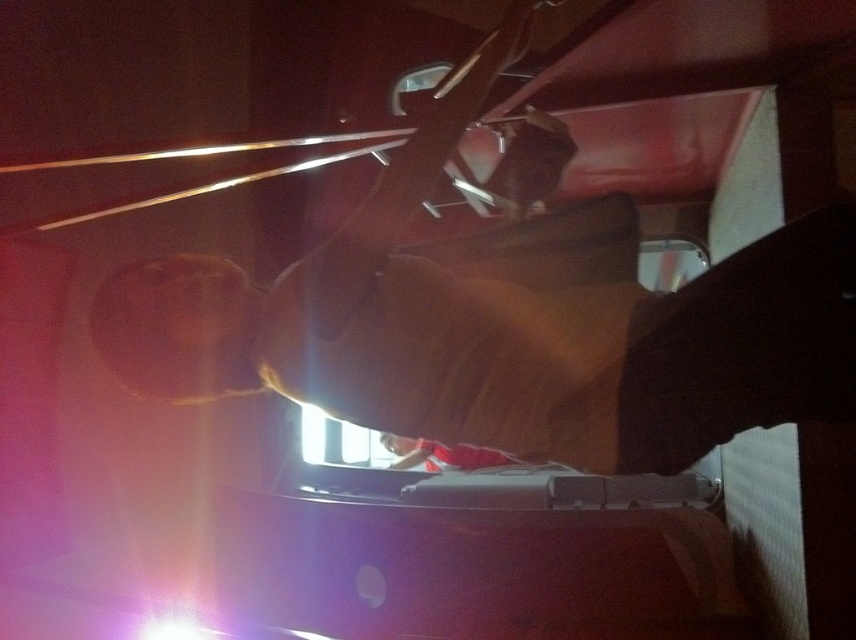
Who is taller, brown leather jacket at center or red fabric at center?

With more height is brown leather jacket at center.

Measure the distance between point (134, 282) and camera.

The distance of point (134, 282) from camera is 3.86 feet.

At what (x,y) coordinates should I click in order to perform the action: click on brown leather jacket at center. Please return your answer as a coordinate pair (x, y). Image resolution: width=856 pixels, height=640 pixels. Looking at the image, I should click on (520, 342).